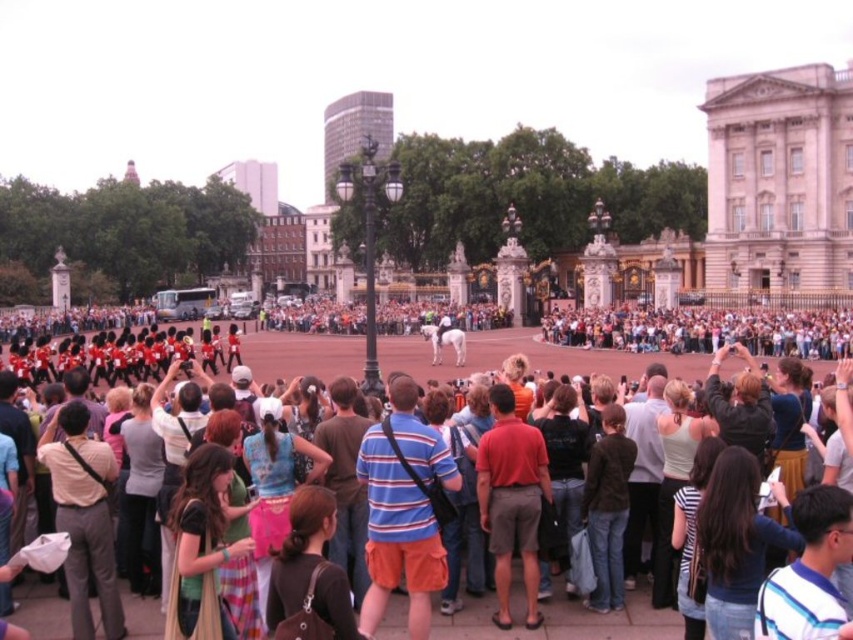
Which is behind, point (715, 579) or point (672, 580)?

Point (672, 580)

Between dark brown hair at center and light gray tank top at center, which one has less height?

Standing shorter between the two is dark brown hair at center.

Is point (752, 593) positioned after point (670, 387)?

No, it is in front of (670, 387).

This screenshot has width=853, height=640. Identify the location of dark brown hair at center. (737, 541).

Who is positioned more to the right, dark brown hair at center or brown fabric bag at center?

From the viewer's perspective, dark brown hair at center appears more on the right side.

Where is `dark brown hair at center`? This screenshot has height=640, width=853. dark brown hair at center is located at coordinates (737, 541).

Does brown fabric bag at center appear under black cotton shirt at center?

Yes, brown fabric bag at center is below black cotton shirt at center.

Which is below, brown fabric bag at center or black cotton shirt at center?

Positioned lower is brown fabric bag at center.

The image size is (853, 640). Describe the element at coordinates (309, 576) in the screenshot. I see `brown fabric bag at center` at that location.

Find the location of a particular element. This screenshot has height=640, width=853. brown fabric bag at center is located at coordinates (309, 576).